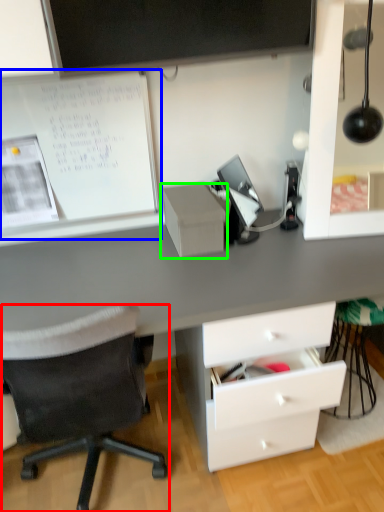
Question: Which is farther away from chair (highlighted by a red box)? bulletin board (highlighted by a blue box) or shelf (highlighted by a green box)?

Choices:
 (A) bulletin board
 (B) shelf

Answer: (A)